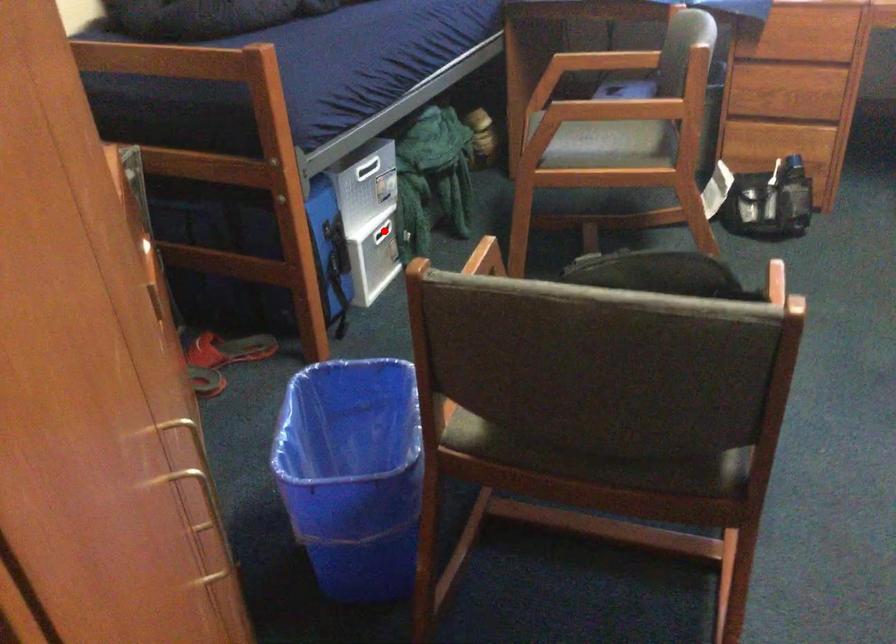
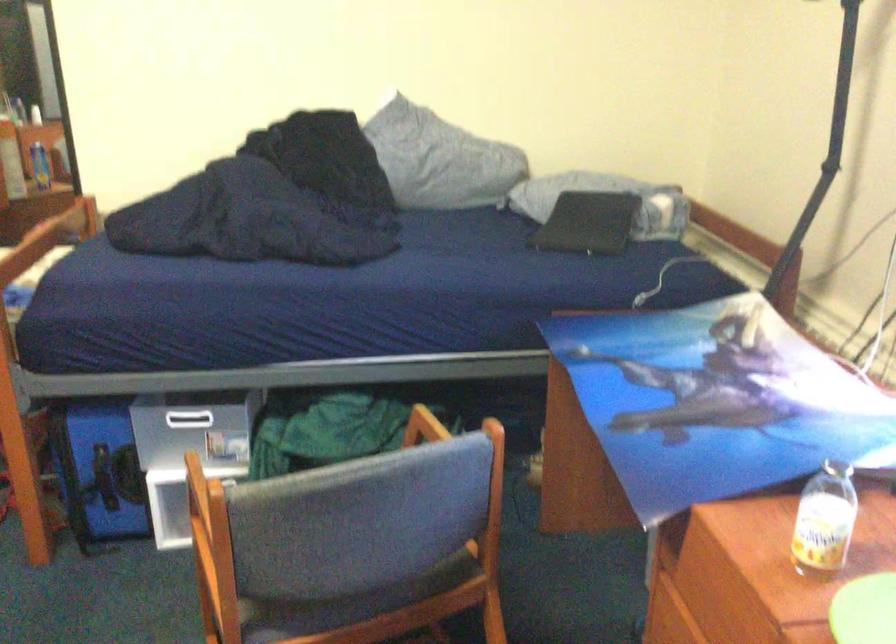
Question: I am providing you with two images of the same scene from different viewpoints. A red point is marked on the first image. Is the red point's position out of view in image 2?

Choices:
 (A) Yes
 (B) No

Answer: (A)